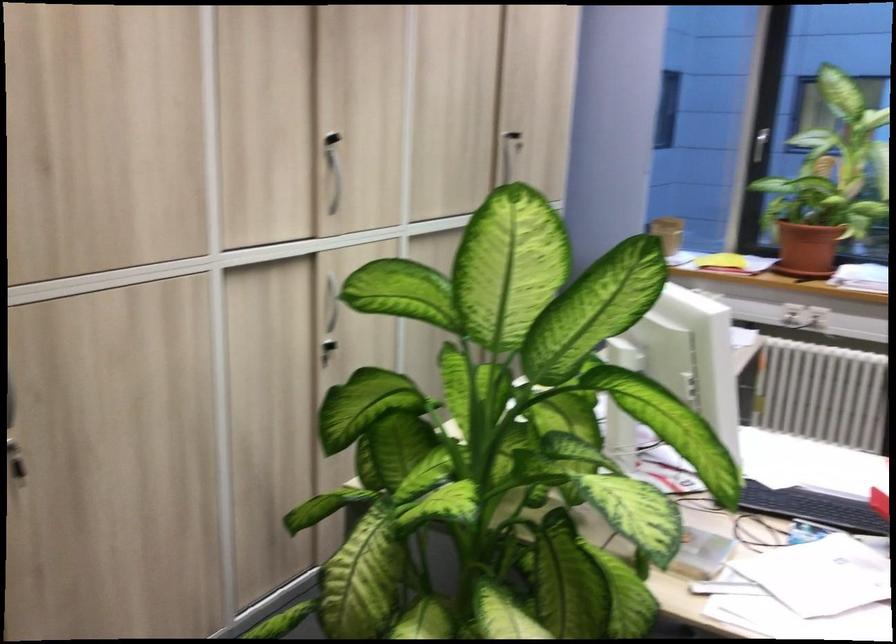
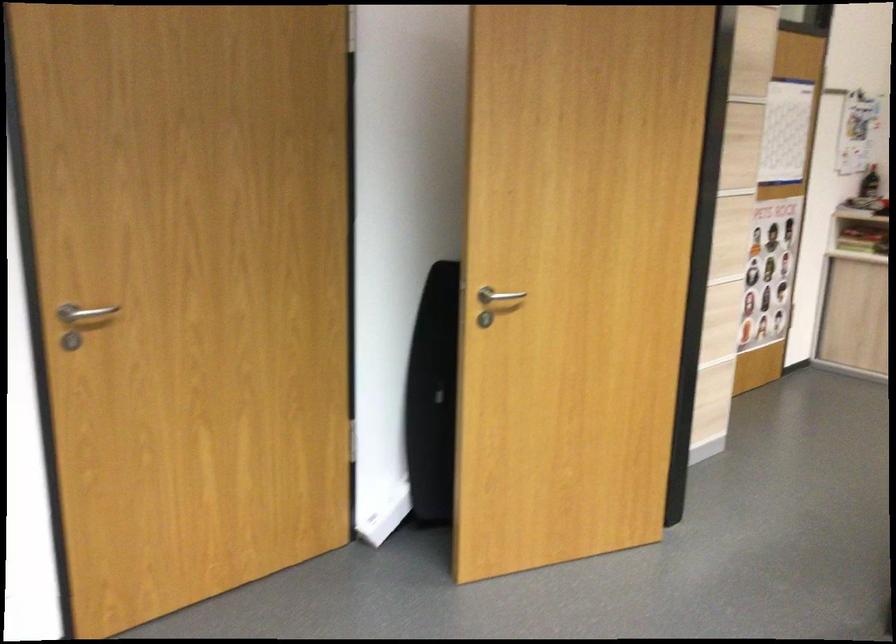
First-person continuous shooting, in which direction is the camera rotating?

The camera rotated toward left-down.